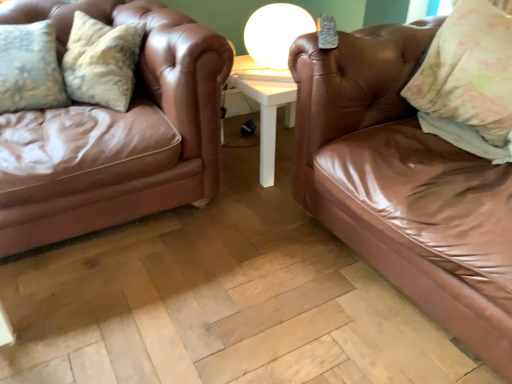
Question: From a real-world perspective, relative to white glossy table lamp at upper center, is brown leather couch at left, which is the second studio couch in right-to-left order, vertically above or below?

Choices:
 (A) above
 (B) below

Answer: (B)

Question: Based on their sizes in the image, would you say brown leather couch at left, which is the first studio couch in left-to-right order, is bigger or smaller than white glossy table lamp at upper center?

Choices:
 (A) small
 (B) big

Answer: (B)

Question: Which object is positioned closest to the floral fabric pillow at upper right?

Choices:
 (A) shiny brown leather couch at right, which is the 2th studio couch in left-to-right order
 (B) brown leather couch at left, which is the first studio couch in left-to-right order
 (C) white glossy table lamp at upper center

Answer: (A)

Question: Which object is the farthest from the shiny brown leather couch at right, the 1th studio couch in the right-to-left sequence?

Choices:
 (A) floral fabric pillow at upper right
 (B) brown leather couch at left, which is the first studio couch in left-to-right order
 (C) white glossy table lamp at upper center

Answer: (B)